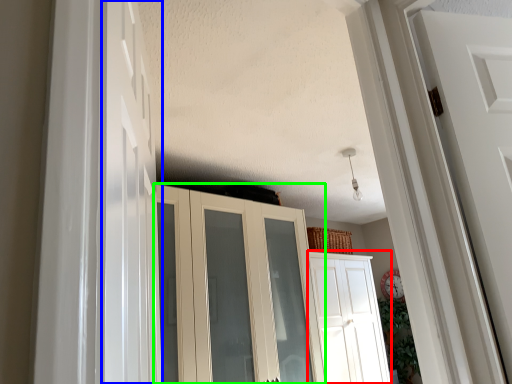
Question: Which object is the farthest from door (highlighted by a red box)? Choose among these: door (highlighted by a blue box) or cupboard (highlighted by a green box).

Choices:
 (A) door
 (B) cupboard

Answer: (A)